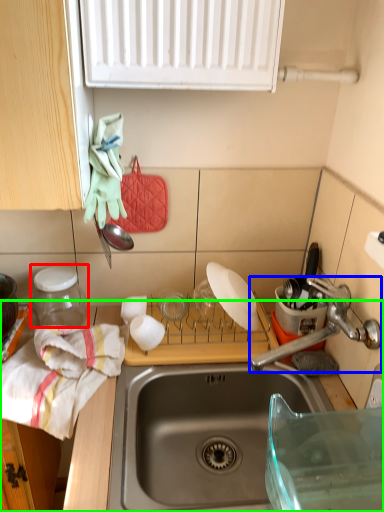
Question: Which is nearer to the appliance (highlighted by a red box)? tap (highlighted by a blue box) or countertop (highlighted by a green box).

Choices:
 (A) tap
 (B) countertop

Answer: (B)